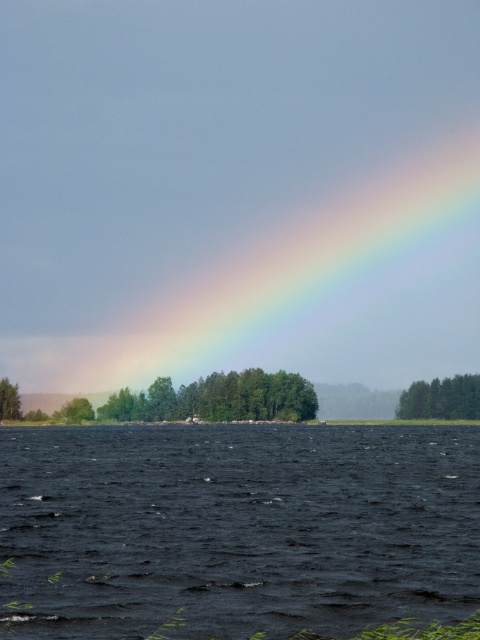
From the picture: Is green leafy trees at center to the left of green matte tree at left from the viewer's perspective?

In fact, green leafy trees at center is to the right of green matte tree at left.

Is point (200, 384) positioned after point (12, 396)?

That is True.

Which is behind, point (223, 381) or point (16, 394)?

Positioned behind is point (223, 381).

Find the location of a particular element. Image resolution: width=480 pixels, height=640 pixels. green leafy trees at center is located at coordinates (218, 397).

Can you confirm if green leafy trees at center is bigger than green leafy tree at left?

Yes.

Identify the location of green leafy trees at center. The image size is (480, 640). pyautogui.click(x=218, y=397).

Is green leafy trees at center wider than green matte tree at lower right?

Yes, green leafy trees at center is wider than green matte tree at lower right.

Is the position of green leafy trees at center more distant than that of green matte tree at lower right?

No, green leafy trees at center is closer to the viewer.

Locate an element on the screen. green leafy trees at center is located at coordinates (218, 397).